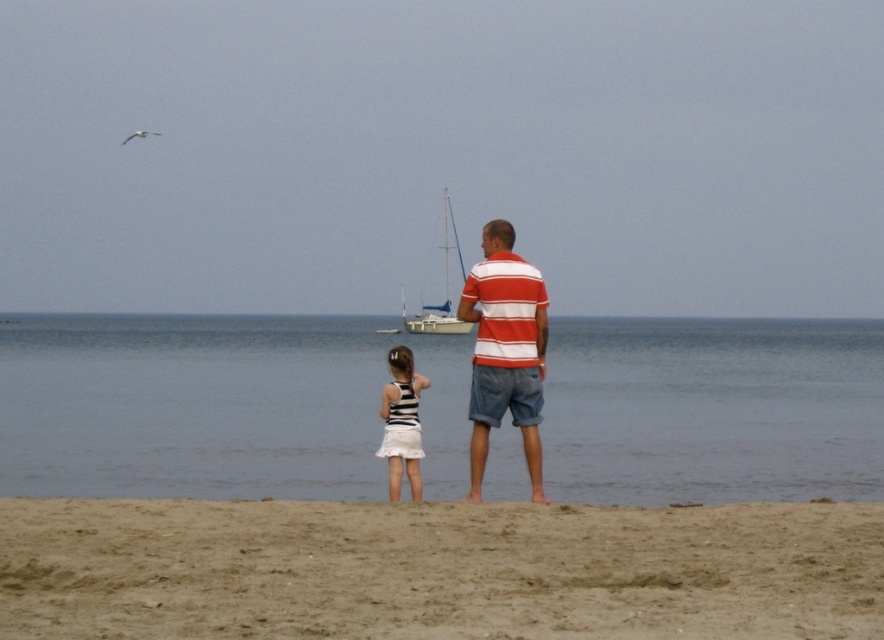
Question: Where is blue water at center located in relation to white matte sailboat at center in the image?

Choices:
 (A) above
 (B) below

Answer: (B)

Question: Which point is farther from the camera taking this photo?

Choices:
 (A) (568, 400)
 (B) (585, 604)

Answer: (A)

Question: Among these objects, which one is nearest to the camera?

Choices:
 (A) striped cotton shirt at center
 (B) brown sandy beach at lower center

Answer: (B)

Question: Does blue water at center have a smaller size compared to white matte sailboat at center?

Choices:
 (A) yes
 (B) no

Answer: (B)

Question: Which point is farther to the camera?

Choices:
 (A) (470, 410)
 (B) (250, 566)
 (C) (466, 433)
 (D) (408, 465)

Answer: (C)

Question: Can you confirm if brown sandy beach at lower center is bigger than striped fabric dress at center?

Choices:
 (A) yes
 (B) no

Answer: (A)